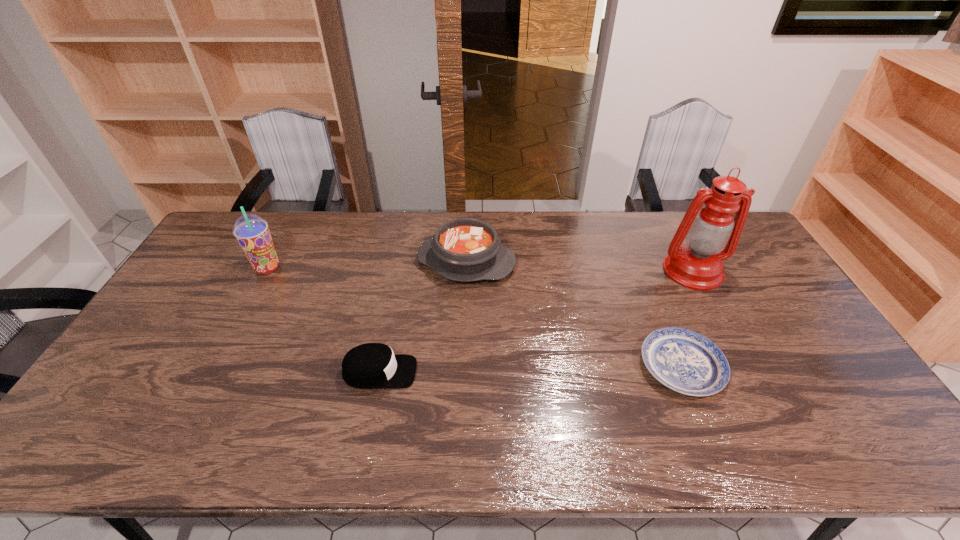
In order to click on free space located 0.310m on the right of the plate in this screenshot , I will do 839,367.

Find the location of `oil lamp at the far edge`. oil lamp at the far edge is located at coordinates (712, 235).

Where is `casserole present at the far edge`? casserole present at the far edge is located at coordinates (465, 249).

The width and height of the screenshot is (960, 540). What are the coordinates of `object that is at the right edge` in the screenshot? It's located at (712, 235).

The height and width of the screenshot is (540, 960). I want to click on object located in the far right corner section of the desktop, so click(x=712, y=235).

Identify the location of free space at the far edge. The width and height of the screenshot is (960, 540). (534, 232).

Locate an element on the screen. vacant space at the near edge of the desktop is located at coordinates (699, 446).

Locate an element on the screen. The image size is (960, 540). free region at the right edge of the desktop is located at coordinates (766, 267).

You are a GUI agent. You are given a task and a screenshot of the screen. Output one action in this format:
    pyautogui.click(x=<x>, y=<y>)
    Task: Click on the free space between the plate and the tallest object
    This screenshot has height=540, width=960.
    Given the screenshot: What is the action you would take?
    pyautogui.click(x=687, y=319)

This screenshot has width=960, height=540. What are the coordinates of `unoccupied area between the cap and the plate` in the screenshot? It's located at (531, 369).